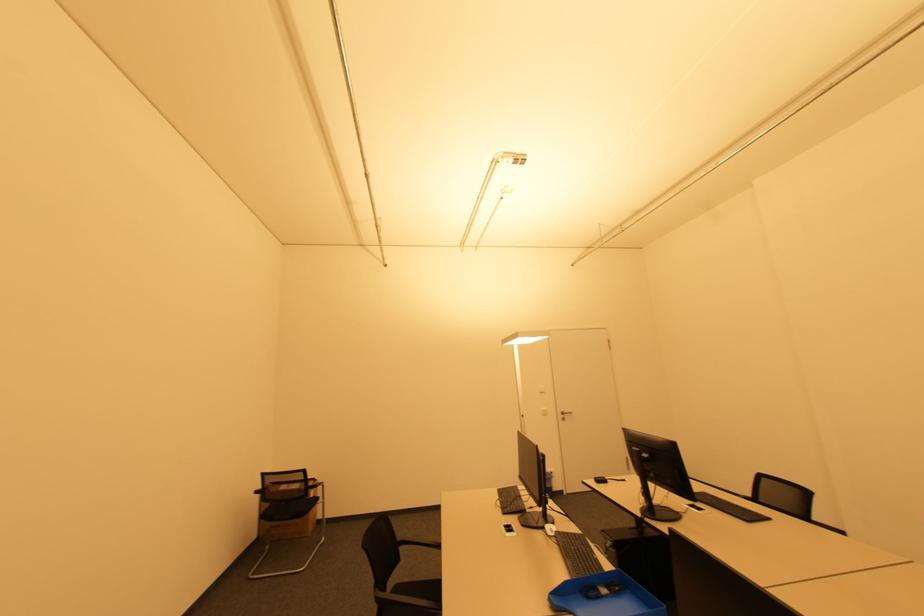
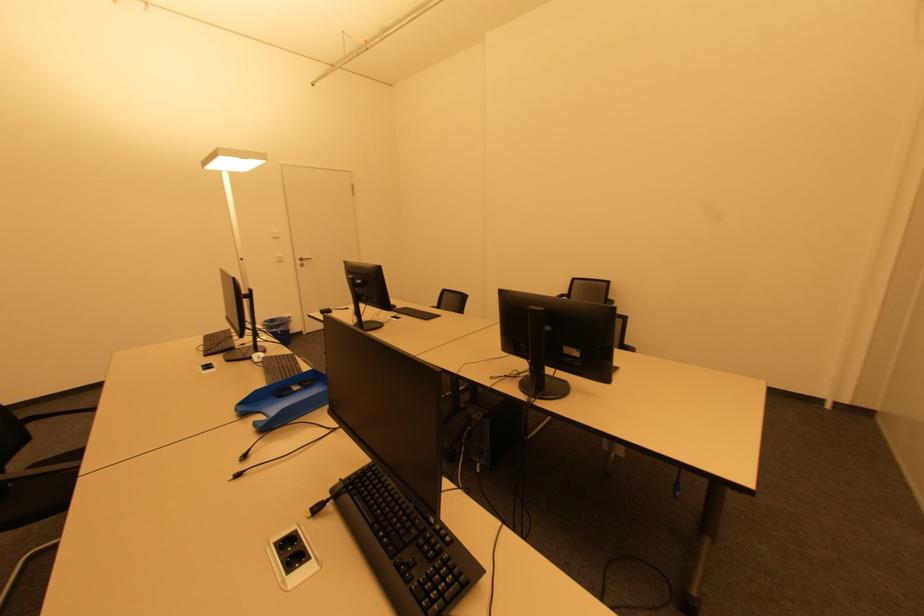
The first image is from the beginning of the video and the second image is from the end. How did the camera likely rotate when shooting the video?

The rotation direction of the camera is right-down.